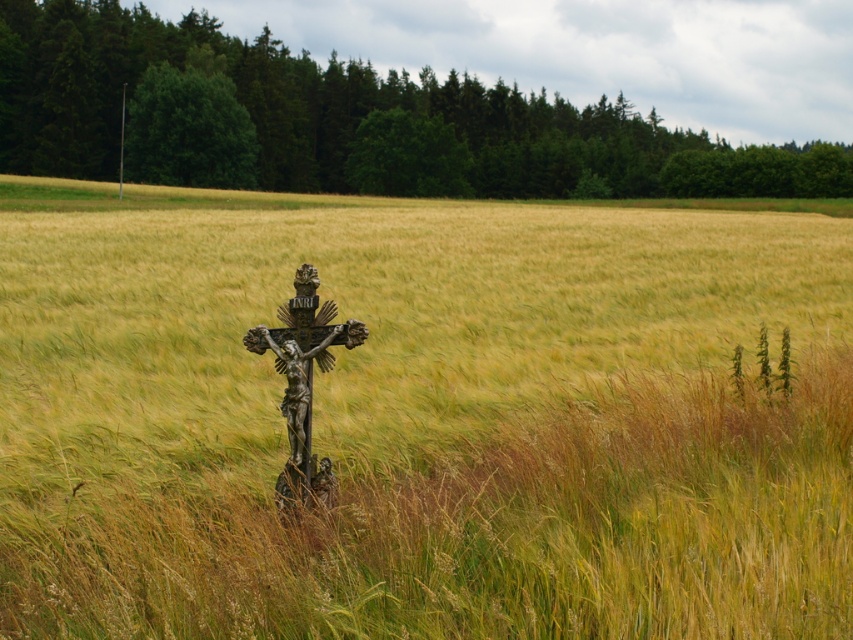
Question: From the image, what is the correct spatial relationship of golden wheat field at center in relation to bronze crucifix at center?

Choices:
 (A) right
 (B) left

Answer: (A)

Question: Is golden wheat field at center behind bronze crucifix at center?

Choices:
 (A) no
 (B) yes

Answer: (A)

Question: Does golden wheat field at center appear on the left side of bronze crucifix at center?

Choices:
 (A) yes
 (B) no

Answer: (B)